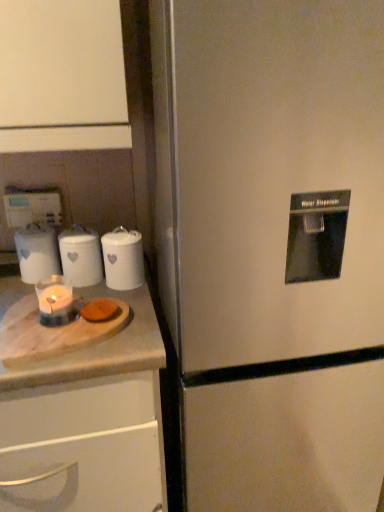
This screenshot has width=384, height=512. Find the location of `free space on the front side of brown matte cookie at lower left`. free space on the front side of brown matte cookie at lower left is located at coordinates (87, 349).